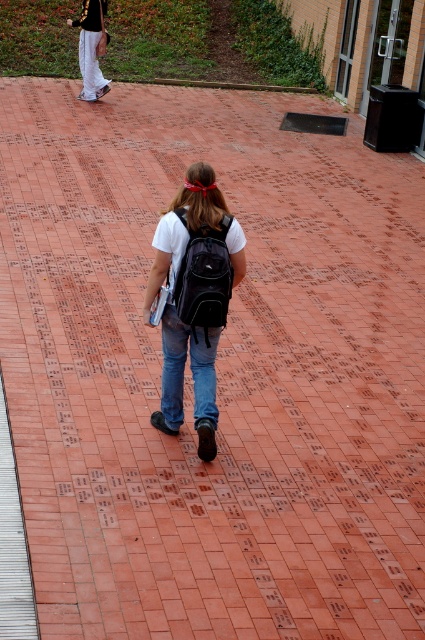
Looking at this image, does matte black backpack at center have a greater width compared to black fabric backpack at center?

Yes, matte black backpack at center is wider than black fabric backpack at center.

Between point (180, 272) and point (223, 264), which one is positioned behind?

The point (180, 272) is more distant.

Is point (206, 397) less distant than point (192, 234)?

No, it is not.

The image size is (425, 640). Identify the location of matte black backpack at center. (193, 298).

Is black fabric backpack at center in front of denim at center?

Yes, black fabric backpack at center is in front of denim at center.

Between point (218, 320) and point (178, 426), which one is positioned in front?

Point (218, 320) is more forward.

Who is more forward, (195, 310) or (178, 368)?

Point (195, 310)

This screenshot has width=425, height=640. In order to click on black fabric backpack at center in this screenshot , I will do `click(204, 276)`.

Between matte black backpack at center and denim at center, which one appears on the right side from the viewer's perspective?

Positioned to the right is denim at center.

Measure the distance between point (x=175, y=346) and camera.

They are 19.25 feet apart.

Locate an element on the screen. This screenshot has height=640, width=425. matte black backpack at center is located at coordinates (193, 298).